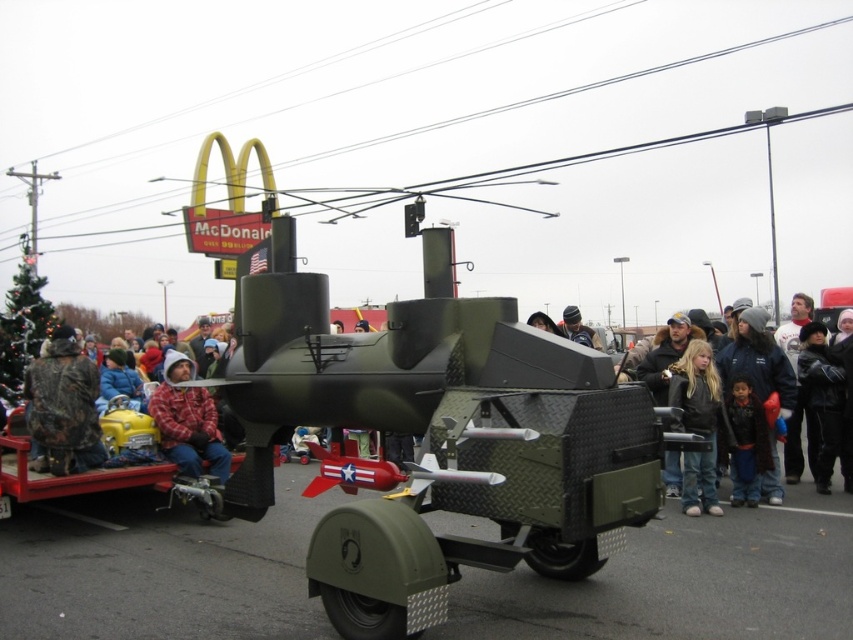
Question: Does dark blue jacket at center appear on the left side of black fleece jacket at lower right?

Choices:
 (A) no
 (B) yes

Answer: (A)

Question: Which of the following is the closest to the observer?

Choices:
 (A) matte black helmet at center
 (B) camo jacket at left

Answer: (B)

Question: Among these objects, which one is farthest from the camera?

Choices:
 (A) flannel plaid jacket at left
 (B) black leather jacket at center

Answer: (B)

Question: Is black leather jacket at lower right positioned behind black fleece jacket at lower right?

Choices:
 (A) yes
 (B) no

Answer: (A)

Question: Among these objects, which one is farthest from the camera?

Choices:
 (A) black fleece jacket at lower right
 (B) black leather jacket at center
 (C) dark blue jacket at center
 (D) camo jacket at left

Answer: (B)

Question: Can you confirm if flannel plaid jacket at left is smaller than matte black helmet at center?

Choices:
 (A) yes
 (B) no

Answer: (A)